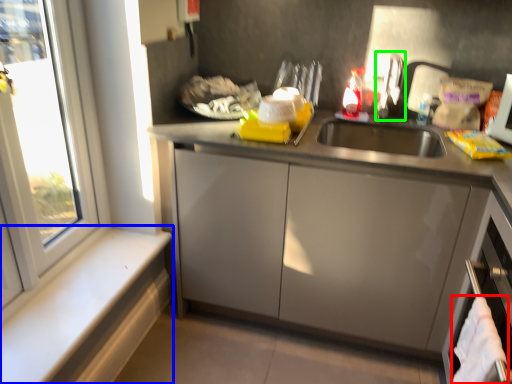
Question: Which object is the closest to the laundry (highlighted by a red box)? Choose among these: window sill (highlighted by a blue box) or faucet (highlighted by a green box).

Choices:
 (A) window sill
 (B) faucet

Answer: (B)